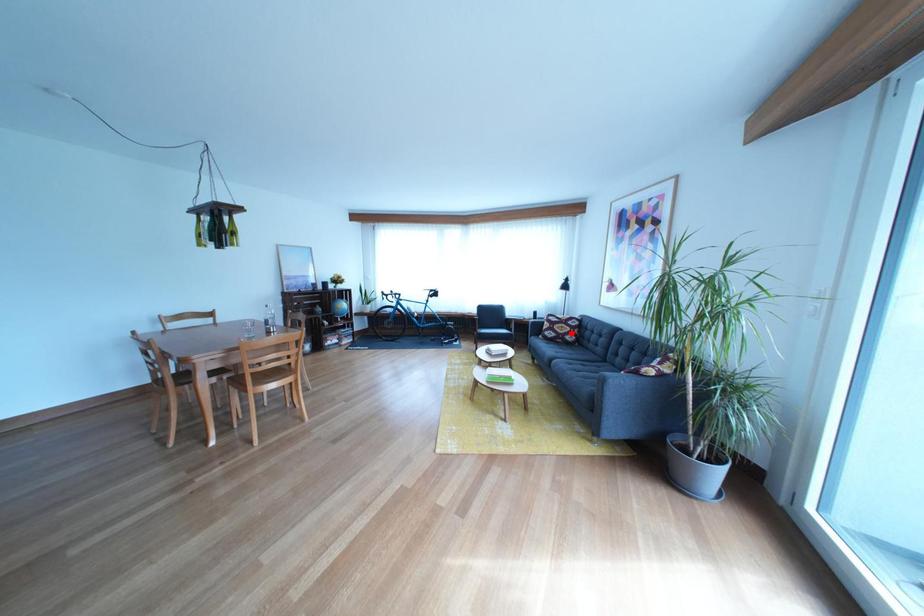
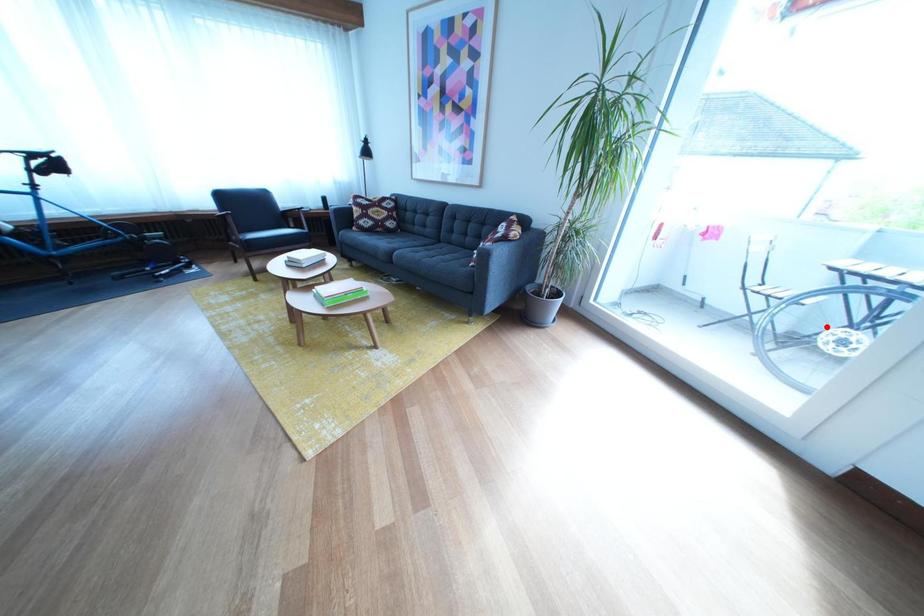
I am providing you with two images of the same scene from different viewpoints. A red point is marked on the first image and another point is marked on the second image. Does the point marked in image1 correspond to the same location as the one in image2?

No